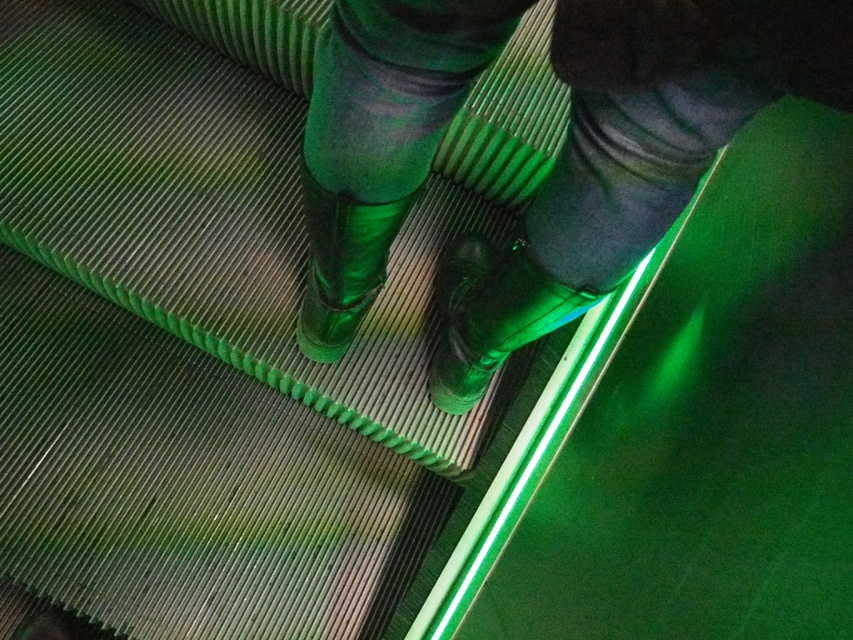
Question: Does green rubber boots at center have a larger size compared to green rubber boot at center?

Choices:
 (A) no
 (B) yes

Answer: (B)

Question: Which object is positioned farthest from the green rubber boots at center?

Choices:
 (A) matte black boot at center
 (B) green rubber boot at center

Answer: (A)

Question: Is green rubber boots at center wider than green rubber boot at center?

Choices:
 (A) no
 (B) yes

Answer: (B)

Question: Is matte black boot at center thinner than green rubber boot at center?

Choices:
 (A) no
 (B) yes

Answer: (B)

Question: Which object is positioned closest to the green rubber boots at center?

Choices:
 (A) matte black boot at center
 (B) green rubber boot at center

Answer: (B)

Question: Based on their relative distances, which object is nearer to the matte black boot at center?

Choices:
 (A) green rubber boot at center
 (B) green rubber boots at center

Answer: (B)